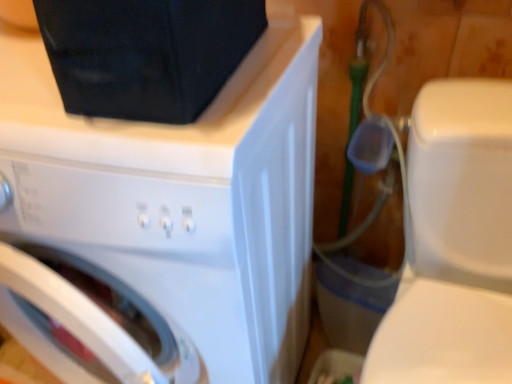
Question: Considering their positions, is white glossy washing machine at upper left located in front of or behind white glossy toilet at right?

Choices:
 (A) behind
 (B) front

Answer: (A)

Question: From the image's perspective, is white glossy washing machine at upper left positioned above or below white glossy toilet at right?

Choices:
 (A) above
 (B) below

Answer: (A)

Question: From a real-world perspective, is white glossy washing machine at upper left above or below white glossy toilet at right?

Choices:
 (A) above
 (B) below

Answer: (A)

Question: Is white glossy toilet at right taller or shorter than white glossy washing machine at upper left?

Choices:
 (A) tall
 (B) short

Answer: (B)

Question: Based on their sizes in the image, would you say white glossy toilet at right is bigger or smaller than white glossy washing machine at upper left?

Choices:
 (A) small
 (B) big

Answer: (A)

Question: Visually, is white glossy toilet at right positioned to the left or to the right of white glossy washing machine at upper left?

Choices:
 (A) right
 (B) left

Answer: (A)

Question: Looking at their shapes, would you say white glossy toilet at right is wider or thinner than white glossy washing machine at upper left?

Choices:
 (A) thin
 (B) wide

Answer: (B)